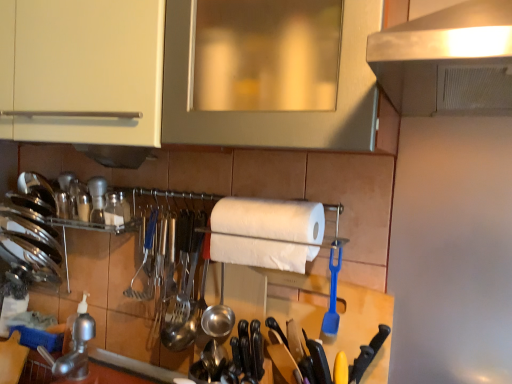
Describe the element at coordinates (183, 285) in the screenshot. I see `shiny metallic utensils at center, which ranks as the third silverware in front-to-back order` at that location.

Where is `shiny metallic utensils at center, positioned as the 1th silverware in left-to-right order`? shiny metallic utensils at center, positioned as the 1th silverware in left-to-right order is located at coordinates (183, 285).

What is the approximate height of stainless steel faucet at lower left?

stainless steel faucet at lower left is 5.99 inches in height.

This screenshot has height=384, width=512. I want to click on wooden spatula at center, so click(x=316, y=356).

Is blue plastic spatula at center, the third silverware in the left-to-right sequence, wider than wooden spatula at center?

In fact, blue plastic spatula at center, the third silverware in the left-to-right sequence, might be narrower than wooden spatula at center.

Based on the photo, could you measure the distance between blue plastic spatula at center, the third silverware in the left-to-right sequence, and wooden spatula at center?

blue plastic spatula at center, the third silverware in the left-to-right sequence, and wooden spatula at center are 15.80 centimeters apart from each other.

Between blue plastic spatula at center, acting as the second silverware starting from the back, and wooden spatula at center, which one has more height?

blue plastic spatula at center, acting as the second silverware starting from the back.

Considering the relative positions of blue plastic spatula at center, acting as the second silverware starting from the back, and wooden spatula at center in the image provided, is blue plastic spatula at center, acting as the second silverware starting from the back, to the right of wooden spatula at center from the viewer's perspective?

Correct, you'll find blue plastic spatula at center, acting as the second silverware starting from the back, to the right of wooden spatula at center.

From the picture: How many degrees apart are the facing directions of blue plastic spatula at center, the 2th silverware from the front, and white matte paper towel at center?

The angular difference between blue plastic spatula at center, the 2th silverware from the front, and white matte paper towel at center is 3.68 degrees.

From the image's perspective, is blue plastic spatula at center, acting as the second silverware starting from the back, above white matte paper towel at center?

No, from the image's perspective, blue plastic spatula at center, acting as the second silverware starting from the back, is not above white matte paper towel at center.

Can you confirm if blue plastic spatula at center, the 2th silverware from the front, is shorter than white matte paper towel at center?

No.

Does blue plastic spatula at center, acting as the second silverware starting from the back, have a lesser width compared to white matte paper towel at center?

Yes, blue plastic spatula at center, acting as the second silverware starting from the back, is thinner than white matte paper towel at center.

Is shiny metallic utensils at center, which ranks as the third silverware in front-to-back order, turned away from white matte cabinet at upper left, arranged as the 1th cabinetry when viewed from the left?

shiny metallic utensils at center, which ranks as the third silverware in front-to-back order, does not have its back to white matte cabinet at upper left, arranged as the 1th cabinetry when viewed from the left.

Are shiny metallic utensils at center, which ranks as the third silverware in front-to-back order, and white matte cabinet at upper left, which is counted as the second cabinetry, starting from the right, making contact?

There is a gap between shiny metallic utensils at center, which ranks as the third silverware in front-to-back order, and white matte cabinet at upper left, which is counted as the second cabinetry, starting from the right.

Can you confirm if shiny metallic utensils at center, which ranks as the third silverware in front-to-back order, is thinner than white matte cabinet at upper left, which is counted as the second cabinetry, starting from the right?

Yes.

Which is further, (338, 263) or (59, 71)?

The point (338, 263) is more distant.

Locate an element on the screen. The width and height of the screenshot is (512, 384). cabinetry that is the 1st object located in front of the blue plastic spatula at center, the 2th silverware from the front is located at coordinates (82, 71).

Visually, is blue plastic spatula at center, acting as the second silverware starting from the back, positioned to the left or to the right of white matte cabinet at upper left, arranged as the 1th cabinetry when viewed from the left?

Based on their positions, blue plastic spatula at center, acting as the second silverware starting from the back, is located to the right of white matte cabinet at upper left, arranged as the 1th cabinetry when viewed from the left.

Is stainless steel faucet at lower left facing away from blue plastic spatula at center, the 2th silverware from the front?

No, stainless steel faucet at lower left is not facing the opposite direction of blue plastic spatula at center, the 2th silverware from the front.

What's the angular difference between stainless steel faucet at lower left and blue plastic spatula at center, the 2th silverware from the front,'s facing directions?

3.86 degrees separate the facing orientations of stainless steel faucet at lower left and blue plastic spatula at center, the 2th silverware from the front.

Which of these two, stainless steel faucet at lower left or blue plastic spatula at center, the third silverware in the left-to-right sequence, is bigger?

With larger size is stainless steel faucet at lower left.

Between stainless steel faucet at lower left and blue plastic spatula at center, acting as the second silverware starting from the back, which one has more height?

Standing taller between the two is blue plastic spatula at center, acting as the second silverware starting from the back.

Which object is more forward, shiny metallic utensils at center, which is the first silverware in back-to-front order, or white glossy cabinet at upper center, placed as the 1th cabinetry when sorted from right to left?

Positioned in front is white glossy cabinet at upper center, placed as the 1th cabinetry when sorted from right to left.

How many degrees apart are the facing directions of shiny metallic utensils at center, positioned as the 1th silverware in left-to-right order, and white glossy cabinet at upper center, which is counted as the second cabinetry, starting from the left?

They differ by 1.15 degrees in their facing directions.

From a real-world perspective, which is physically above, shiny metallic utensils at center, which ranks as the third silverware in front-to-back order, or white glossy cabinet at upper center, placed as the 1th cabinetry when sorted from right to left?

In real-world perspective, white glossy cabinet at upper center, placed as the 1th cabinetry when sorted from right to left, is above.

Are shiny metallic utensils at center, positioned as the 1th silverware in left-to-right order, and white glossy cabinet at upper center, which is counted as the second cabinetry, starting from the left, located far from each other?

They are positioned close to each other.

Does white glossy cabinet at upper center, placed as the 1th cabinetry when sorted from right to left, have a lesser height compared to polished metal knife set at center, the third silverware viewed from the back?

In fact, white glossy cabinet at upper center, placed as the 1th cabinetry when sorted from right to left, may be taller than polished metal knife set at center, the third silverware viewed from the back.

Between white glossy cabinet at upper center, which is counted as the second cabinetry, starting from the left, and polished metal knife set at center, the third silverware viewed from the back, which one has smaller size?

Smaller between the two is polished metal knife set at center, the third silverware viewed from the back.

Would you say white glossy cabinet at upper center, which is counted as the second cabinetry, starting from the left, contains polished metal knife set at center, acting as the 1th silverware starting from the front?

No, polished metal knife set at center, acting as the 1th silverware starting from the front, is not inside white glossy cabinet at upper center, which is counted as the second cabinetry, starting from the left.

Which silverware is the 1st one when counting from the back of the white glossy cabinet at upper center, placed as the 1th cabinetry when sorted from right to left? Please provide its 2D coordinates.

[(233, 358)]

The image size is (512, 384). What are the coordinates of `the 3rd silverware above when counting from the wooden spatula at center (from the image's perspective)` in the screenshot? It's located at (333, 293).

From the white matte paper towel at center, count 1st silverwares backward and point to it. Please provide its 2D coordinates.

[(333, 293)]

Considering their positions, is wooden spatula at center positioned closer to white matte cabinet at upper left, arranged as the 1th cabinetry when viewed from the left, than shiny metallic utensils at center, positioned as the 1th silverware in left-to-right order?

shiny metallic utensils at center, positioned as the 1th silverware in left-to-right order, lies closer to white matte cabinet at upper left, arranged as the 1th cabinetry when viewed from the left, than the other object.

Looking at the image, which one is located further to wooden spatula at center, stainless steel faucet at lower left or blue plastic spatula at center, the third silverware in the left-to-right sequence?

stainless steel faucet at lower left.

Looking at the image, which one is located closer to white matte paper towel at center, wooden spatula at center or shiny metallic utensils at center, acting as the third silverware starting from the right?

wooden spatula at center is positioned closer to the anchor white matte paper towel at center.

Estimate the real-world distances between objects in this image. Which object is closer to shiny metallic utensils at center, acting as the third silverware starting from the right, white matte cabinet at upper left, which is counted as the second cabinetry, starting from the right, or stainless steel faucet at lower left?

stainless steel faucet at lower left is closer to shiny metallic utensils at center, acting as the third silverware starting from the right.

From the image, which object appears to be farther from white matte cabinet at upper left, arranged as the 1th cabinetry when viewed from the left, stainless steel faucet at lower left or blue plastic spatula at center, which appears as the first silverware when viewed from the right?

stainless steel faucet at lower left.

From the image, which object appears to be farther from white matte paper towel at center, polished metal knife set at center, the 2th silverware when ordered from left to right, or shiny metallic utensils at center, positioned as the 1th silverware in left-to-right order?

polished metal knife set at center, the 2th silverware when ordered from left to right.

Estimate the real-world distances between objects in this image. Which object is closer to white glossy cabinet at upper center, which is counted as the second cabinetry, starting from the left, wooden spatula at center or stainless steel faucet at lower left?

The object closer to white glossy cabinet at upper center, which is counted as the second cabinetry, starting from the left, is wooden spatula at center.

Based on their spatial positions, is wooden spatula at center or white glossy cabinet at upper center, which is counted as the second cabinetry, starting from the left, closer to blue plastic spatula at center, acting as the second silverware starting from the back?

wooden spatula at center lies closer to blue plastic spatula at center, acting as the second silverware starting from the back, than the other object.

Identify the location of paper towel between white glossy cabinet at upper center, which is counted as the second cabinetry, starting from the left, and shiny metallic utensils at center, which is the first silverware in back-to-front order, from top to bottom. The height and width of the screenshot is (384, 512). (266, 232).

Locate an element on the screen. The height and width of the screenshot is (384, 512). paper towel between white matte cabinet at upper left, arranged as the 1th cabinetry when viewed from the left, and shiny metallic utensils at center, which ranks as the third silverware in front-to-back order, in the vertical direction is located at coordinates point(266,232).

Image resolution: width=512 pixels, height=384 pixels. What are the coordinates of `paper towel between white matte cabinet at upper left, which is counted as the second cabinetry, starting from the right, and polished metal knife set at center, the third silverware viewed from the back, in the up-down direction` in the screenshot? It's located at (266, 232).

You are a GUI agent. You are given a task and a screenshot of the screen. Output one action in this format:
    pyautogui.click(x=<x>, y=<y>)
    Task: Click on the silverware between white matte cabinet at upper left, arranged as the 1th cabinetry when viewed from the left, and shiny metallic utensils at center, positioned as the 1th silverware in left-to-right order, in the up-down direction
    The image size is (512, 384).
    Given the screenshot: What is the action you would take?
    333,293